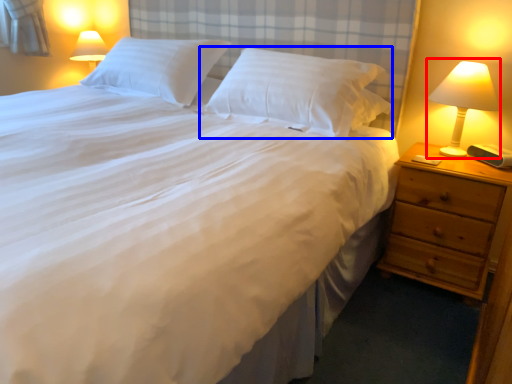
Question: Which of the following is the farthest to the observer, bedside lamp (highlighted by a red box) or pillow (highlighted by a blue box)?

Choices:
 (A) bedside lamp
 (B) pillow

Answer: (B)